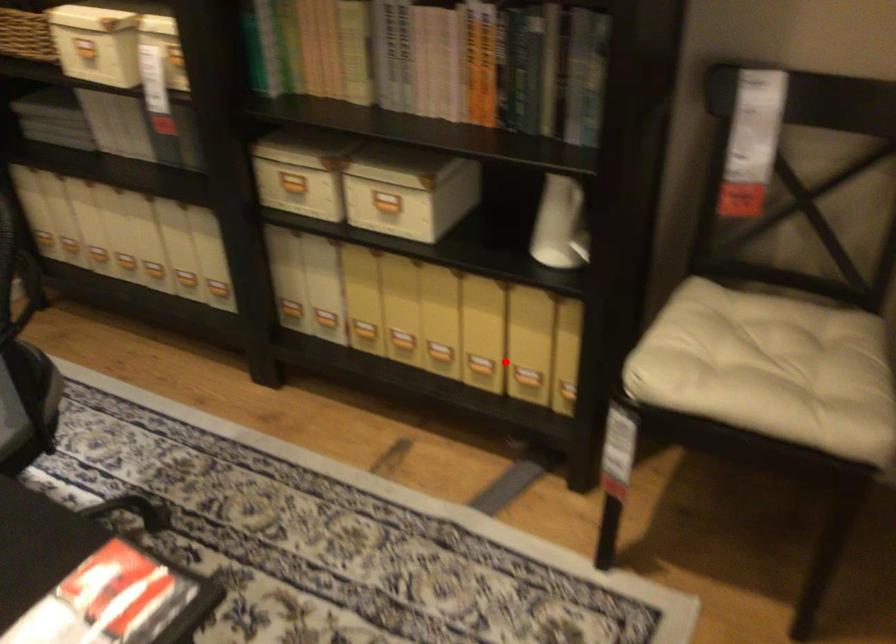
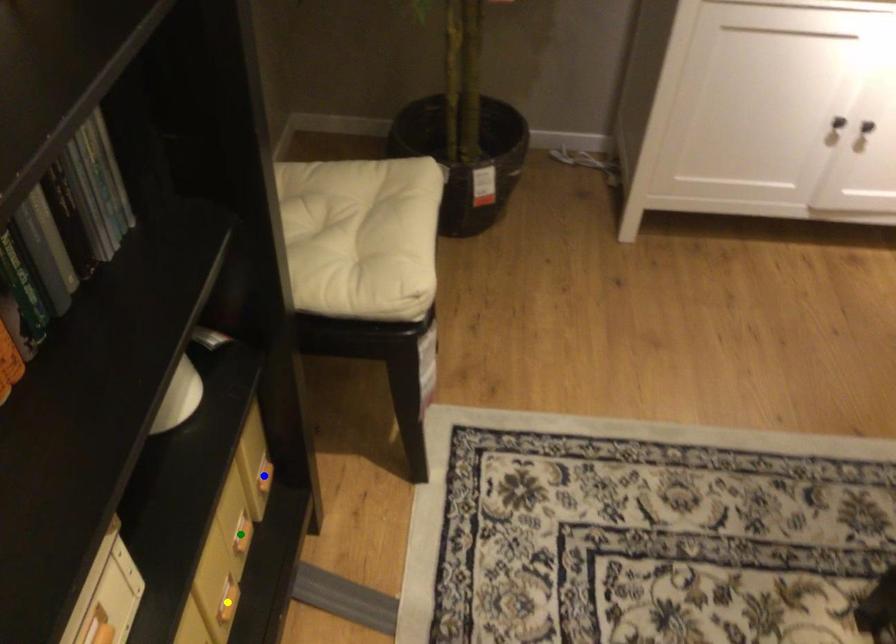
Question: I am providing you with two images of the same scene from different viewpoints. A red point is marked on the first image. You are given multiple points on the second image. Which point in image 2 is actually the same real-world point as the red point in image 1?

Choices:
 (A) blue point
 (B) yellow point
 (C) green point

Answer: (B)